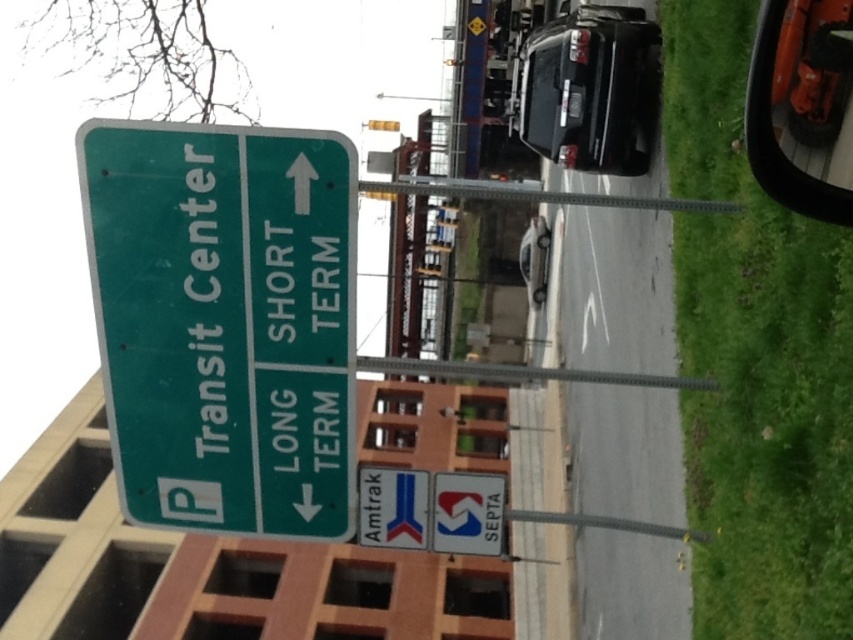
Question: Which object is closer to the camera taking this photo?

Choices:
 (A) shiny black truck at upper right
 (B) green matte sign at upper left
 (C) orange plastic view mirror at upper right

Answer: (C)

Question: Is shiny black truck at upper right bigger than white plastic sign at lower center?

Choices:
 (A) yes
 (B) no

Answer: (A)

Question: Does green matte sign at upper left have a lesser width compared to white plastic sign at lower center?

Choices:
 (A) yes
 (B) no

Answer: (B)

Question: Which point appears farthest from the camera in this image?

Choices:
 (A) (808, 51)
 (B) (469, 545)
 (C) (347, 241)
 (D) (416, 513)

Answer: (B)

Question: Is orange plastic view mirror at upper right thinner than white plastic sign at lower center?

Choices:
 (A) no
 (B) yes

Answer: (B)

Question: Which point appears farthest from the camera in this image?

Choices:
 (A) (397, 477)
 (B) (160, 211)
 (C) (606, 170)
 (D) (488, 512)

Answer: (C)